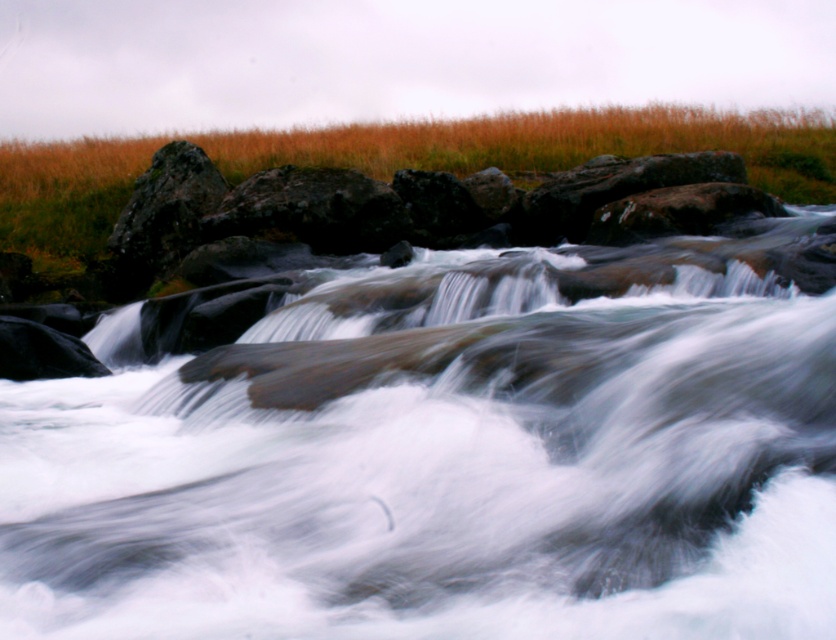
Does point (607, 627) lie in front of point (339, 134)?

That is True.

Who is more distant from viewer, (37, 397) or (77, 240)?

Point (77, 240)

At what (x,y) coordinates should I click in order to perform the action: click on white smooth water at center. Please return your answer as a coordinate pair (x, y). Looking at the image, I should click on (444, 468).